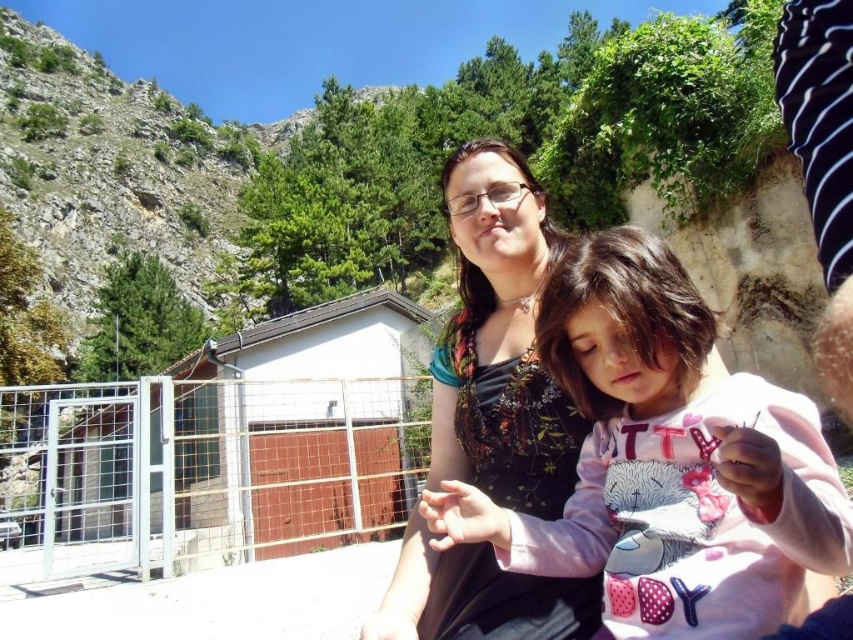
You are standing at the point labeled point (453, 230) and want to move towards the point labeled point (662, 612). Based on the scene description, will you have to walk through any obstacles between these two points?

Point (662, 612) is in front of point (453, 230), so there are no obstacles between them. You can walk directly towards point (662, 612) without any hindrance.

From the picture: You are standing at the origin point in the image. The pink fleece sweater at center is located at coordinate point (665, 461). If you want to reach the pink fleece sweater at center, which direction should you move? Please answer with either north, south, east, or west.

The pink fleece sweater at center is located at coordinate point (665, 461). Since the coordinate system is not specified, but typically in images, the origin is at the top left corner. Moving east would increase the x coordinate, and moving south would increase the y coordinate. To reach (665, 461) from the origin, you would need to move east and south. However, since the question asks for a single direction, it might be best to state both directions. But the question restricts to one of the four. Wait

You are a photographer trying to capture a closeup of the pink fleece sweater at center without the matte floral dress at center blocking the view. Is this possible given their positions?

The pink fleece sweater at center is in front of the matte floral dress at center, so you can take a closeup of the pink fleece sweater at center without the matte floral dress at center blocking the view.